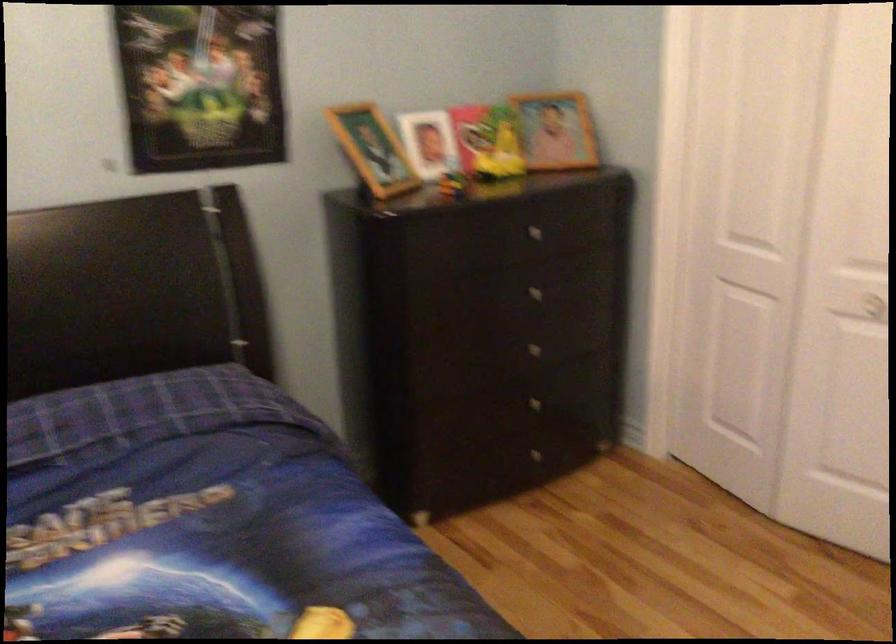
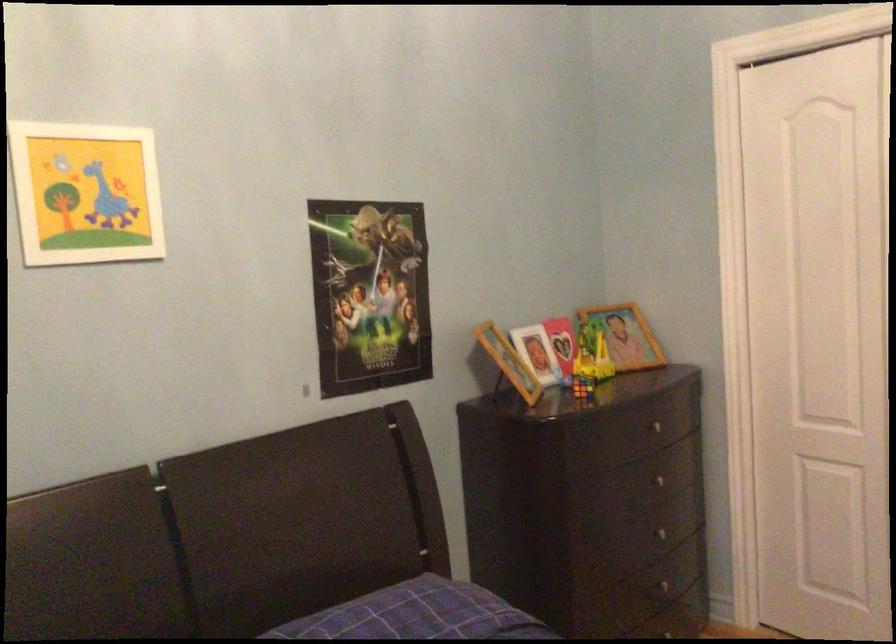
Find the pixel in the second image that matches the point at 528,287 in the first image.

(656, 480)